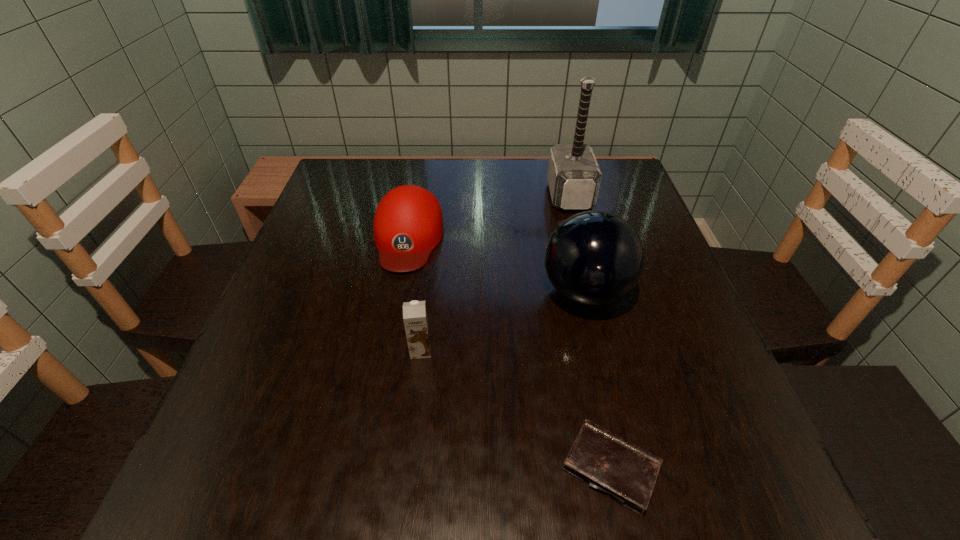
At what (x,y) coordinates should I click in order to perform the action: click on free location located on the side of the bowling ball with the finger holes. Please return your answer as a coordinate pair (x, y). The image size is (960, 540). Looking at the image, I should click on (454, 293).

The width and height of the screenshot is (960, 540). I want to click on vacant space located 0.060m on the side of the bowling ball with the finger holes, so click(512, 293).

Locate an element on the screen. free location located on the left of the chocolate milk is located at coordinates (268, 350).

You are a GUI agent. You are given a task and a screenshot of the screen. Output one action in this format:
    pyautogui.click(x=<x>, y=<y>)
    Task: Click on the free space located 0.310m on the front-facing side of the baseball cap
    The height and width of the screenshot is (540, 960).
    Given the screenshot: What is the action you would take?
    pyautogui.click(x=376, y=406)

Identify the location of vacant space positioned on the back of the diary. (575, 298).

Locate an element on the screen. hammer that is at the far edge is located at coordinates (573, 176).

Find the location of `baseball cap located at the far edge`. baseball cap located at the far edge is located at coordinates (408, 224).

Where is `object present at the near edge`? object present at the near edge is located at coordinates (626, 473).

At what (x,y) coordinates should I click in order to perform the action: click on hammer present at the right edge. Please return your answer as a coordinate pair (x, y). Looking at the image, I should click on (573, 176).

Where is `bowling ball that is at the right edge`? The image size is (960, 540). bowling ball that is at the right edge is located at coordinates (594, 258).